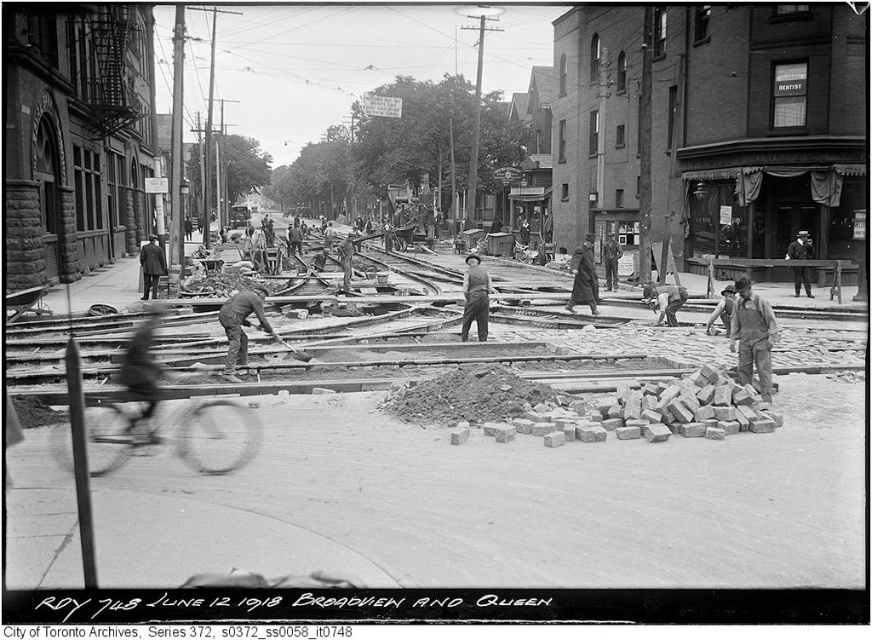
Does point (142, 269) lie behind point (804, 240)?

No, it is not.

Does dark brown suit at left have a greater width compared to smooth leather hat at center?

Yes, dark brown suit at left is wider than smooth leather hat at center.

Image resolution: width=872 pixels, height=640 pixels. Describe the element at coordinates (151, 266) in the screenshot. I see `dark brown suit at left` at that location.

Locate an element on the screen. dark brown suit at left is located at coordinates click(x=151, y=266).

Is rustic wooden shovel at center wider than smooth leather hat at center?

Yes.

Find the location of a particular element. Image resolution: width=872 pixels, height=640 pixels. rustic wooden shovel at center is located at coordinates (475, 298).

What do you see at coordinates (475, 298) in the screenshot? I see `rustic wooden shovel at center` at bounding box center [475, 298].

The width and height of the screenshot is (872, 640). What are the coordinates of `rustic wooden shovel at center` in the screenshot? It's located at 475,298.

Which is below, smooth wooden planks at center or dark brown suit at left?

Positioned lower is smooth wooden planks at center.

Who is positioned more to the right, smooth wooden planks at center or dark brown suit at left?

smooth wooden planks at center

Image resolution: width=872 pixels, height=640 pixels. What are the coordinates of `smooth wooden planks at center` in the screenshot? It's located at (503, 502).